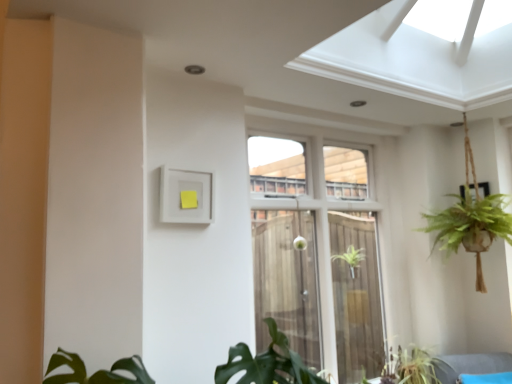
Question: From a real-world perspective, is white glass window at center located beneath green leafy plant at lower center?

Choices:
 (A) yes
 (B) no

Answer: (B)

Question: Are white glass window at center and green leafy plant at lower center far apart?

Choices:
 (A) yes
 (B) no

Answer: (B)

Question: Is white glass window at center smaller than green leafy plant at lower center?

Choices:
 (A) no
 (B) yes

Answer: (A)

Question: Considering the relative sizes of white glass window at center and green leafy plant at lower center in the image provided, is white glass window at center shorter than green leafy plant at lower center?

Choices:
 (A) no
 (B) yes

Answer: (A)

Question: Is white glass window at center thinner than green leafy plant at lower center?

Choices:
 (A) no
 (B) yes

Answer: (B)

Question: Is white glass window at center facing towards green leafy plant at lower center?

Choices:
 (A) yes
 (B) no

Answer: (A)

Question: From a real-world perspective, is green leafy plant at lower center located beneath white glass window at center?

Choices:
 (A) yes
 (B) no

Answer: (A)

Question: Is white glass window at center inside green leafy plant at lower center?

Choices:
 (A) yes
 (B) no

Answer: (B)

Question: Is green leafy plant at lower center bigger than white glass window at center?

Choices:
 (A) yes
 (B) no

Answer: (B)

Question: Is green leafy plant at lower center further to the viewer compared to white glass window at center?

Choices:
 (A) yes
 (B) no

Answer: (A)

Question: Considering the relative sizes of green leafy plant at lower center and white glass window at center in the image provided, is green leafy plant at lower center shorter than white glass window at center?

Choices:
 (A) yes
 (B) no

Answer: (A)

Question: Can you confirm if green leafy plant at lower center is wider than white glass window at center?

Choices:
 (A) yes
 (B) no

Answer: (A)

Question: Considering the positions of white glass window at center and green leafy plant at lower center in the image, is white glass window at center wider or thinner than green leafy plant at lower center?

Choices:
 (A) thin
 (B) wide

Answer: (A)